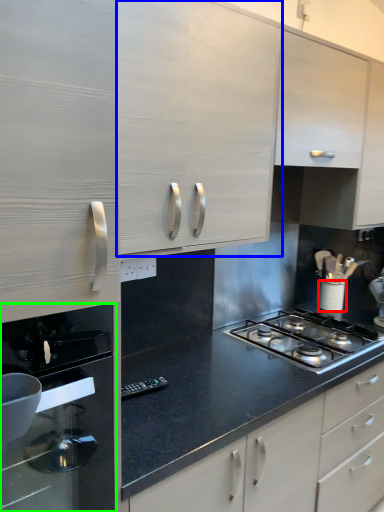
Question: Which object is positioned farthest from kitchen appliance (highlighted by a red box)? Select from cabinetry (highlighted by a blue box) and home appliance (highlighted by a green box).

Choices:
 (A) cabinetry
 (B) home appliance

Answer: (B)